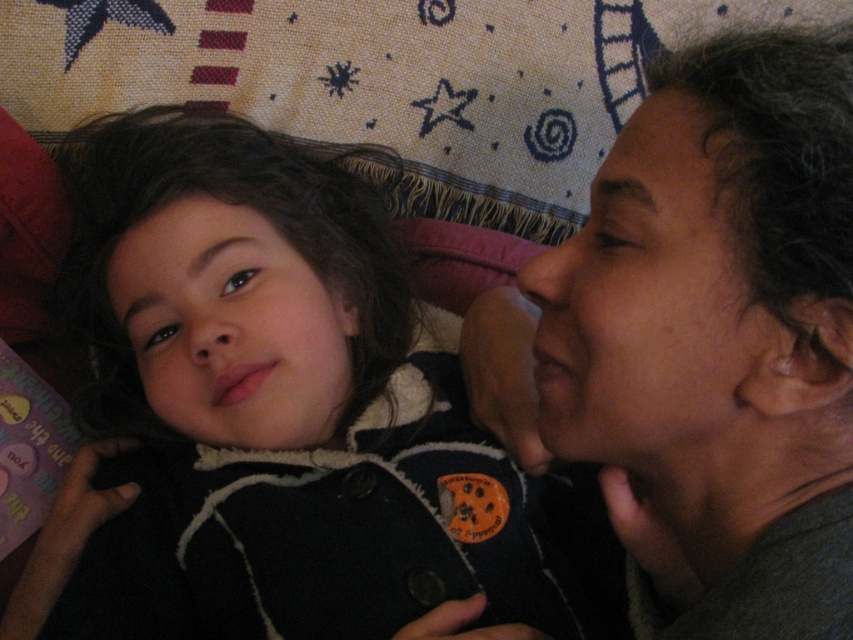
Between point (514, 540) and point (648, 440), which one is positioned in front?

Point (648, 440)

Between dark blue fleece jacket at center and dark gray hair at right, which one is positioned higher?

dark gray hair at right

The image size is (853, 640). I want to click on dark blue fleece jacket at center, so click(x=283, y=419).

Does dark blue fleece jacket at center have a lesser width compared to smooth skin face at center?

In fact, dark blue fleece jacket at center might be wider than smooth skin face at center.

Between dark blue fleece jacket at center and smooth skin face at center, which one has more height?

dark blue fleece jacket at center is taller.

Is point (309, 442) farther from camera compared to point (310, 333)?

That is True.

The image size is (853, 640). What are the coordinates of `dark blue fleece jacket at center` in the screenshot? It's located at (283, 419).

Measure the distance between dark gray hair at right and smooth skin face at right.

A distance of 0.79 inches exists between dark gray hair at right and smooth skin face at right.

Between dark gray hair at right and smooth skin face at right, which one appears on the right side from the viewer's perspective?

dark gray hair at right

Identify the location of dark gray hair at right. (718, 336).